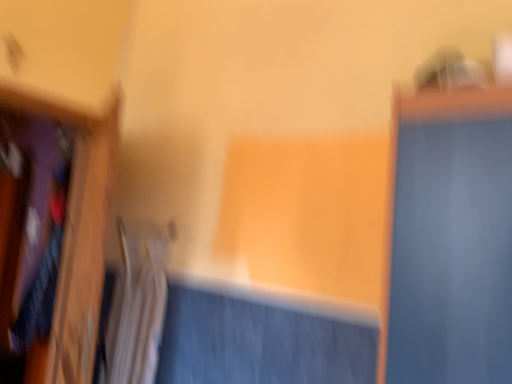
Question: Does wooden frame at left have a lesser width compared to velvet-like fabric shirt at left?

Choices:
 (A) yes
 (B) no

Answer: (A)

Question: From a real-world perspective, is wooden frame at left on top of velvet-like fabric shirt at left?

Choices:
 (A) no
 (B) yes

Answer: (B)

Question: Can you confirm if wooden frame at left is shorter than velvet-like fabric shirt at left?

Choices:
 (A) yes
 (B) no

Answer: (B)

Question: Is wooden frame at left to the left of velvet-like fabric shirt at left from the viewer's perspective?

Choices:
 (A) yes
 (B) no

Answer: (B)

Question: From a real-world perspective, is wooden frame at left beneath velvet-like fabric shirt at left?

Choices:
 (A) yes
 (B) no

Answer: (B)

Question: From a real-world perspective, is wooden frame at left positioned above or below velvet-like fabric shirt at left?

Choices:
 (A) below
 (B) above

Answer: (B)

Question: In the image, is wooden frame at left positioned in front of or behind velvet-like fabric shirt at left?

Choices:
 (A) behind
 (B) front

Answer: (B)

Question: Is wooden frame at left spatially inside velvet-like fabric shirt at left, or outside of it?

Choices:
 (A) outside
 (B) inside

Answer: (A)

Question: In terms of height, does wooden frame at left look taller or shorter compared to velvet-like fabric shirt at left?

Choices:
 (A) short
 (B) tall

Answer: (B)

Question: In terms of width, does wooden frame at left look wider or thinner when compared to white fabric radiator at lower left?

Choices:
 (A) thin
 (B) wide

Answer: (A)

Question: Visually, is wooden frame at left positioned to the left or to the right of white fabric radiator at lower left?

Choices:
 (A) left
 (B) right

Answer: (A)

Question: Considering the positions of wooden frame at left and white fabric radiator at lower left in the image, is wooden frame at left taller or shorter than white fabric radiator at lower left?

Choices:
 (A) tall
 (B) short

Answer: (A)

Question: Is point (112, 142) positioned closer to the camera than point (132, 380)?

Choices:
 (A) farther
 (B) closer

Answer: (B)

Question: Would you say white fabric radiator at lower left is to the left or to the right of velvet-like fabric shirt at left in the picture?

Choices:
 (A) right
 (B) left

Answer: (A)

Question: From the image's perspective, is white fabric radiator at lower left located above or below velvet-like fabric shirt at left?

Choices:
 (A) below
 (B) above

Answer: (B)